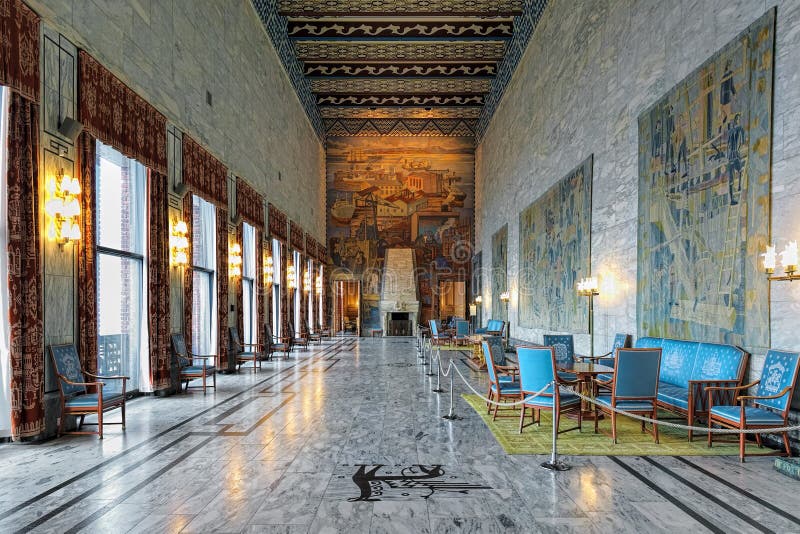
Identify the location of green area rug. The width and height of the screenshot is (800, 534). (594, 437).